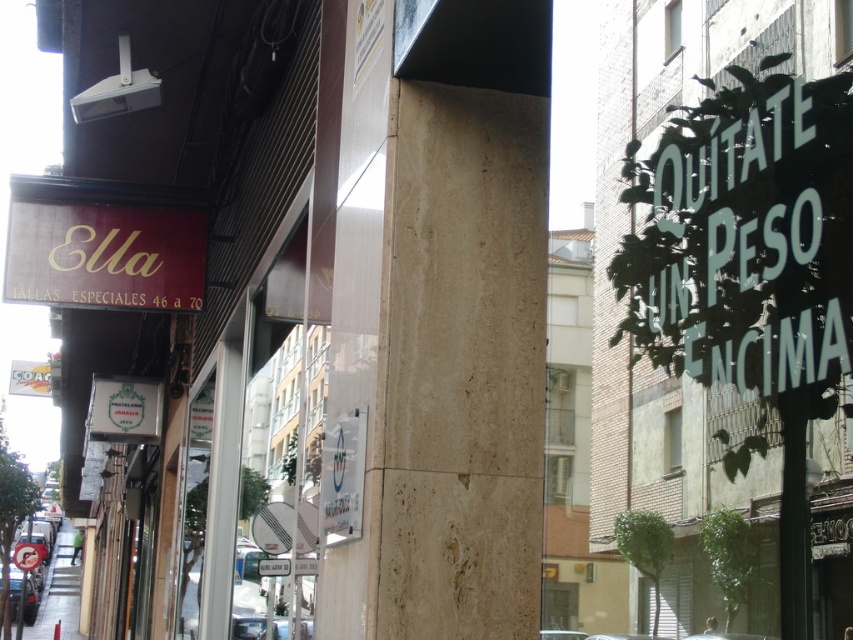
Based on the photo, you are a delivery person trying to locate the entrance of the store named Ella. You see the beige travertine pillar at center and the maroon matte signboard at upper left. Which object is positioned higher up in the image?

The maroon matte signboard at upper left is positioned higher up in the image than the beige travertine pillar at center.

You are standing at the point marked as point [463,324] in the image. What object is directly beneath your feet?

The beige travertine pillar at center is directly beneath the point [463,324].

You are a delivery person who needs to place a 2.5 meter tall package in the street scene. The package must be placed near the beige travertine pillar at center and the maroon matte signboard at upper left. Can the package fit vertically between these two objects without exceeding their heights?

The beige travertine pillar at center is taller than the maroon matte signboard at upper left. Since the package is 2.5 meters tall, it will exceed the height of the maroon matte signboard at upper left but may not exceed the beige travertine pillar at center. However, since the question asks if it can fit without exceeding both, the answer is no because it would surpass the shorter maroon matte signboard at upper left.